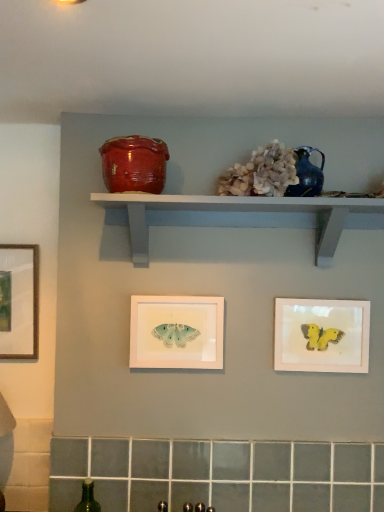
Question: Considering the relative sizes of white matte butterfly at center, which is the first picture frame from left to right, and teal ceramic vase at upper center in the image provided, is white matte butterfly at center, which is the first picture frame from left to right, shorter than teal ceramic vase at upper center?

Choices:
 (A) no
 (B) yes

Answer: (A)

Question: Can you confirm if white matte butterfly at center, the 2th picture frame viewed from the right, is bigger than teal ceramic vase at upper center?

Choices:
 (A) no
 (B) yes

Answer: (B)

Question: Is white matte butterfly at center, the 2th picture frame viewed from the right, in front of teal ceramic vase at upper center?

Choices:
 (A) no
 (B) yes

Answer: (A)

Question: Does white matte butterfly at center, which is the first picture frame from left to right, turn towards teal ceramic vase at upper center?

Choices:
 (A) yes
 (B) no

Answer: (B)

Question: From a real-world perspective, is white matte butterfly at center, which is the first picture frame from left to right, on teal ceramic vase at upper center?

Choices:
 (A) yes
 (B) no

Answer: (B)

Question: In the image, is white painted wood shelf at upper center positioned in front of or behind teal ceramic vase at upper center?

Choices:
 (A) behind
 (B) front

Answer: (B)

Question: In terms of height, does white painted wood shelf at upper center look taller or shorter compared to teal ceramic vase at upper center?

Choices:
 (A) tall
 (B) short

Answer: (A)

Question: Considering the positions of white painted wood shelf at upper center and teal ceramic vase at upper center in the image, is white painted wood shelf at upper center bigger or smaller than teal ceramic vase at upper center?

Choices:
 (A) big
 (B) small

Answer: (A)

Question: From the image's perspective, is white painted wood shelf at upper center located above or below teal ceramic vase at upper center?

Choices:
 (A) above
 (B) below

Answer: (B)

Question: Is white matte butterfly at center, which is the first picture frame from left to right, taller or shorter than teal ceramic vase at upper center?

Choices:
 (A) tall
 (B) short

Answer: (A)

Question: Considering the positions of point (132, 335) and point (316, 183), is point (132, 335) closer or farther from the camera than point (316, 183)?

Choices:
 (A) closer
 (B) farther

Answer: (B)

Question: Considering the relative positions of white matte butterfly at center, which is the first picture frame from left to right, and teal ceramic vase at upper center in the image provided, is white matte butterfly at center, which is the first picture frame from left to right, to the left or to the right of teal ceramic vase at upper center?

Choices:
 (A) left
 (B) right

Answer: (A)

Question: From a real-world perspective, relative to teal ceramic vase at upper center, is white matte butterfly at center, which is the first picture frame from left to right, vertically above or below?

Choices:
 (A) above
 (B) below

Answer: (B)

Question: From the image's perspective, is matte pink picture frame at lower right, which ranks as the 2th picture frame in left-to-right order, above or below white matte butterfly at center, which is the first picture frame from left to right?

Choices:
 (A) below
 (B) above

Answer: (A)

Question: In terms of height, does matte pink picture frame at lower right, which ranks as the 2th picture frame in left-to-right order, look taller or shorter compared to white matte butterfly at center, the 2th picture frame viewed from the right?

Choices:
 (A) short
 (B) tall

Answer: (A)